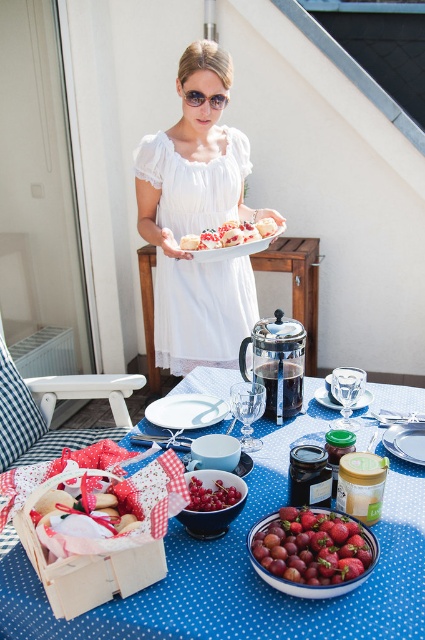
You are a chef preparing a meal and see the shiny red strawberries at center and the sunglasses at center on the table. Which item is closer to you?

The shiny red strawberries at center are closer to you because they are in front of the sunglasses at center.